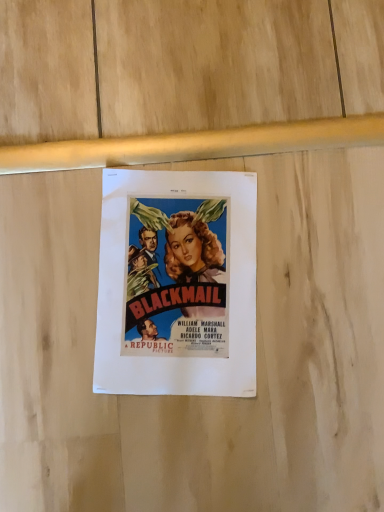
The width and height of the screenshot is (384, 512). Describe the element at coordinates (177, 284) in the screenshot. I see `matte paper poster at center` at that location.

Find the location of a particular element. This screenshot has height=512, width=384. matte paper poster at center is located at coordinates (177, 284).

Where is `matte paper poster at center`? matte paper poster at center is located at coordinates (177, 284).